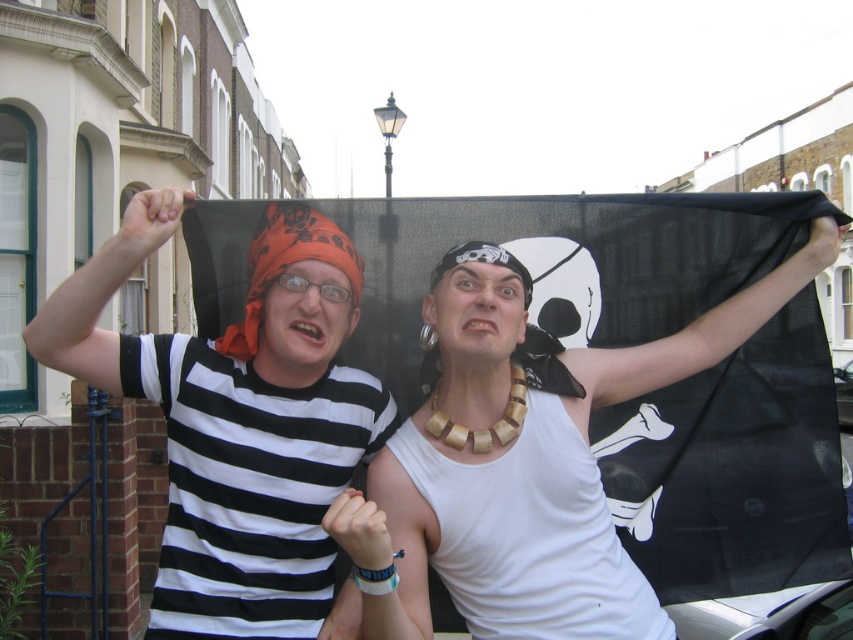
Based on the photo, does matte black flag at center lie behind matte black bandana at left?

Yes, it is.

How distant is matte black flag at center from matte black bandana at left?

10.35 inches

You are a GUI agent. You are given a task and a screenshot of the screen. Output one action in this format:
    pyautogui.click(x=<x>, y=<y>)
    Task: Click on the matte black flag at center
    The height and width of the screenshot is (640, 853).
    Given the screenshot: What is the action you would take?
    pyautogui.click(x=381, y=353)

Find the location of a particular element. matte black flag at center is located at coordinates (381, 353).